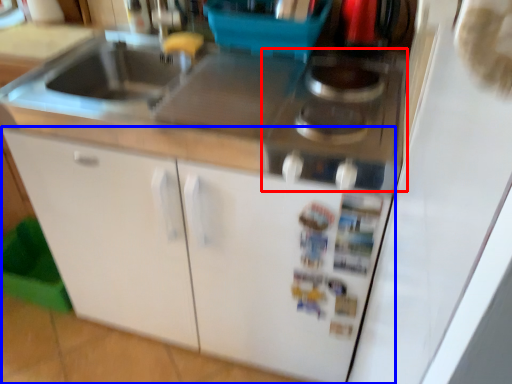
Question: Among these objects, which one is farthest to the camera, gas stove (highlighted by a red box) or cabinetry (highlighted by a blue box)?

Choices:
 (A) gas stove
 (B) cabinetry

Answer: (B)